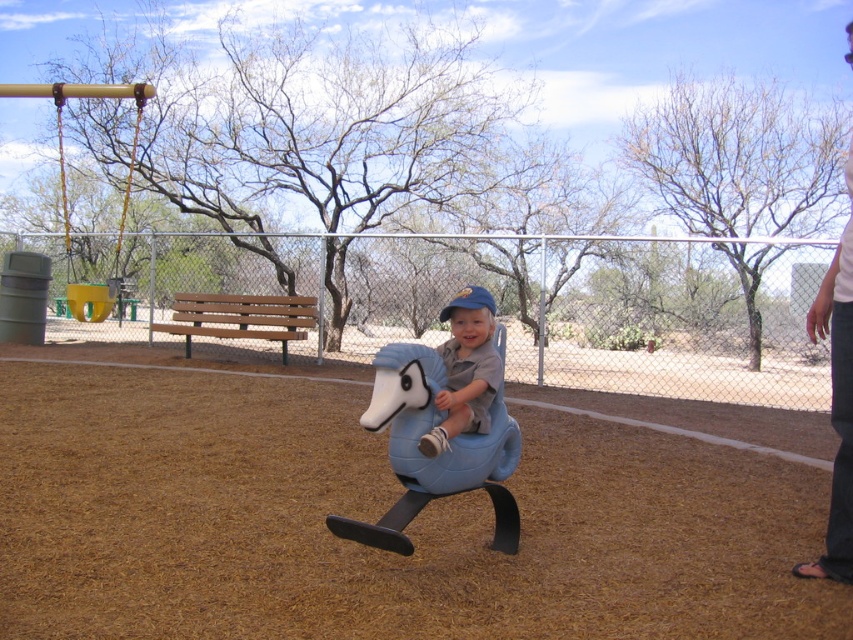
Question: Which point is farther to the camera?

Choices:
 (A) white cotton shirt at upper right
 (B) matte blue plush horse at center
 (C) blue matte plastic horse at center

Answer: (B)

Question: Which is nearer to the blue matte plastic horse at center?

Choices:
 (A) white cotton shirt at upper right
 (B) yellow plastic swing at upper left

Answer: (A)

Question: Is blue matte plastic horse at center thinner than white cotton shirt at upper right?

Choices:
 (A) no
 (B) yes

Answer: (B)

Question: Is blue matte plastic horse at center to the left of white cotton shirt at upper right from the viewer's perspective?

Choices:
 (A) yes
 (B) no

Answer: (A)

Question: Can you confirm if white cotton shirt at upper right is positioned below matte blue plush horse at center?

Choices:
 (A) yes
 (B) no

Answer: (B)

Question: Which of the following is the farthest from the observer?

Choices:
 (A) blue matte plastic horse at center
 (B) white cotton shirt at upper right
 (C) matte blue plush horse at center
 (D) yellow plastic swing at upper left

Answer: (D)